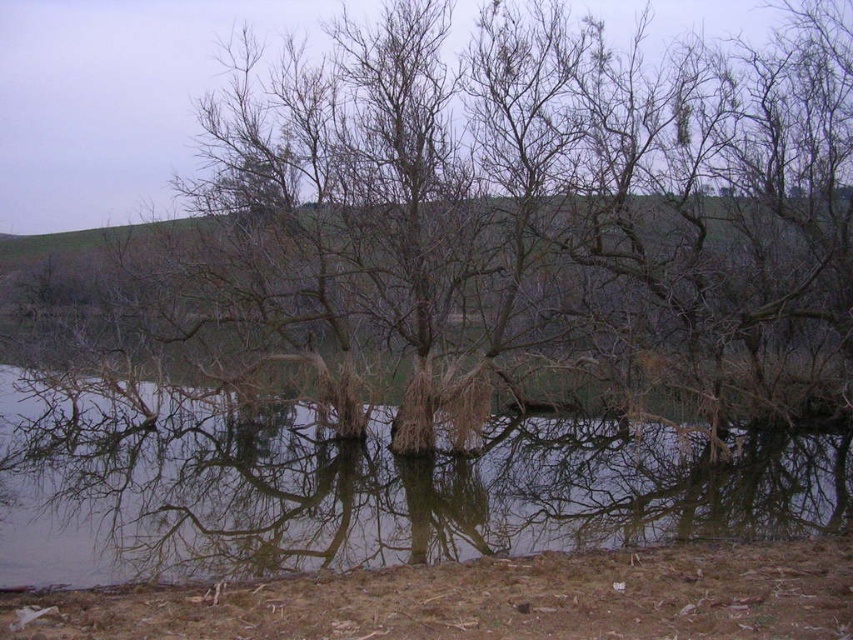
Is transparent water at center wider than brown matte tree at center?

Yes, transparent water at center is wider than brown matte tree at center.

Which of these two, transparent water at center or brown matte tree at center, stands taller?

transparent water at center is taller.

Where is `transparent water at center`? Image resolution: width=853 pixels, height=640 pixels. transparent water at center is located at coordinates (393, 499).

The width and height of the screenshot is (853, 640). I want to click on transparent water at center, so click(x=393, y=499).

Can you confirm if brown/dry wood tree at center is wider than transparent water at center?

Indeed, brown/dry wood tree at center has a greater width compared to transparent water at center.

Is point (822, 278) more distant than point (68, 556)?

That is True.

Find the location of a particular element. The image size is (853, 640). brown/dry wood tree at center is located at coordinates (515, 218).

Can you confirm if brown/dry wood tree at center is smaller than brown matte tree at center?

Actually, brown/dry wood tree at center might be larger than brown matte tree at center.

Is point (570, 230) less distant than point (432, 481)?

No.

Who is more distant from viewer, (718, 321) or (430, 458)?

Positioned behind is point (718, 321).

Where is `brown/dry wood tree at center`? The height and width of the screenshot is (640, 853). brown/dry wood tree at center is located at coordinates (515, 218).